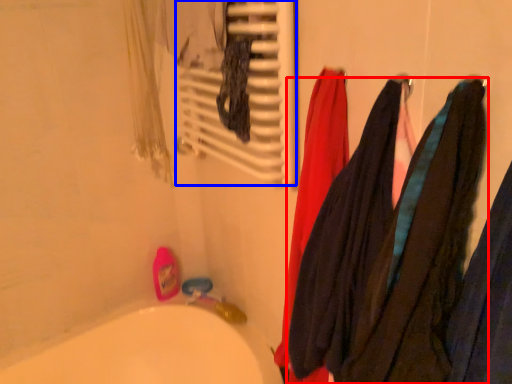
Question: Which object appears closest to the camera in this image, towel (highlighted by a red box) or radiator (highlighted by a blue box)?

Choices:
 (A) towel
 (B) radiator

Answer: (A)